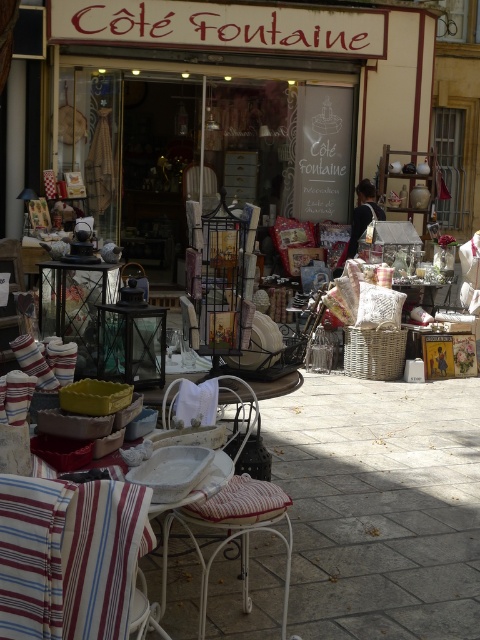
Between point (94, 556) and point (233, 392), which one is positioned behind?

Point (233, 392)

Who is shorter, striped fabric cushion at lower left or white wicker chair at center?

striped fabric cushion at lower left is shorter.

Does point (72, 625) lie in front of point (243, 480)?

That is True.

The image size is (480, 640). Identify the location of striped fabric cushion at lower left. (68, 556).

Between striped fabric cushion at lower left and white striped fabric at lower left, which one is positioned higher?

A: Positioned higher is white striped fabric at lower left.

Describe the element at coordinates (68, 556) in the screenshot. The image size is (480, 640). I see `striped fabric cushion at lower left` at that location.

Between point (58, 544) and point (48, 474), which one is positioned in front?

Positioned in front is point (58, 544).

Find the location of a particular element. striped fabric cushion at lower left is located at coordinates (68, 556).

In the scene shown: Between white wicker chair at center and white striped fabric at lower left, which one has more height?

With more height is white wicker chair at center.

Between point (243, 506) and point (154, 627), which one is positioned in front?

Point (154, 627)

Does point (167, 394) come farther from viewer compared to point (186, 502)?

Yes, it is.

You are a GUI agent. You are given a task and a screenshot of the screen. Output one action in this format:
    pyautogui.click(x=<x>, y=<y>)
    Task: Click on the white wicker chair at center
    The image size is (480, 640).
    Given the screenshot: What is the action you would take?
    pyautogui.click(x=233, y=522)